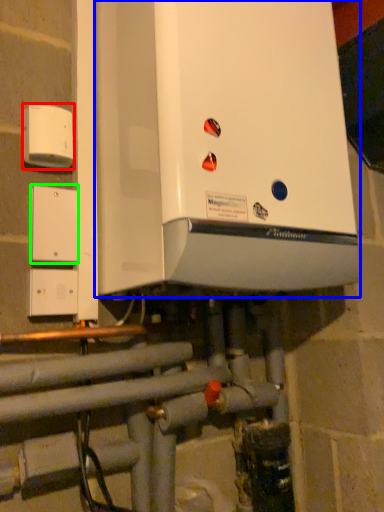
Question: Considering the real-world distances, which object is closest to electric outlet (highlighted by a red box)? home appliance (highlighted by a blue box) or light switch (highlighted by a green box).

Choices:
 (A) home appliance
 (B) light switch

Answer: (B)